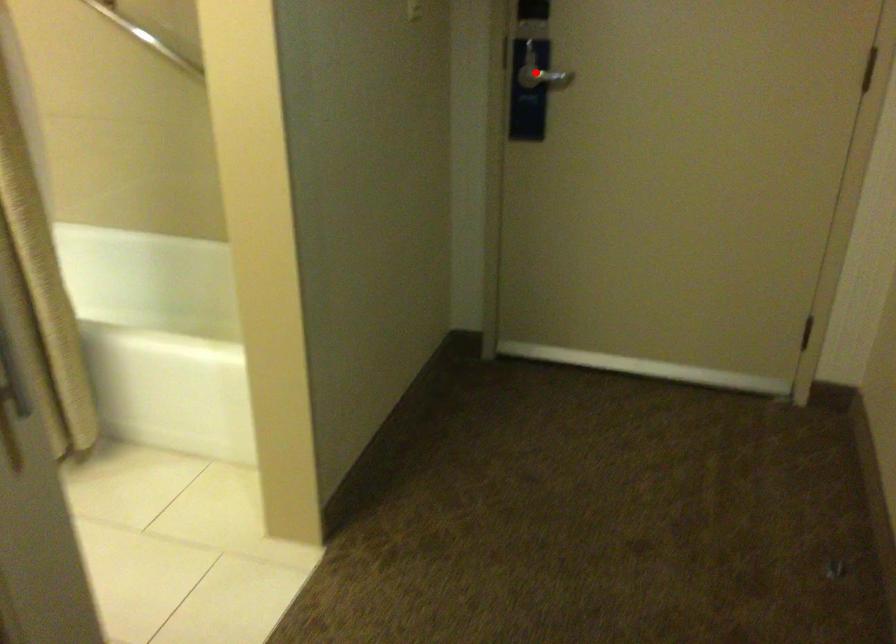
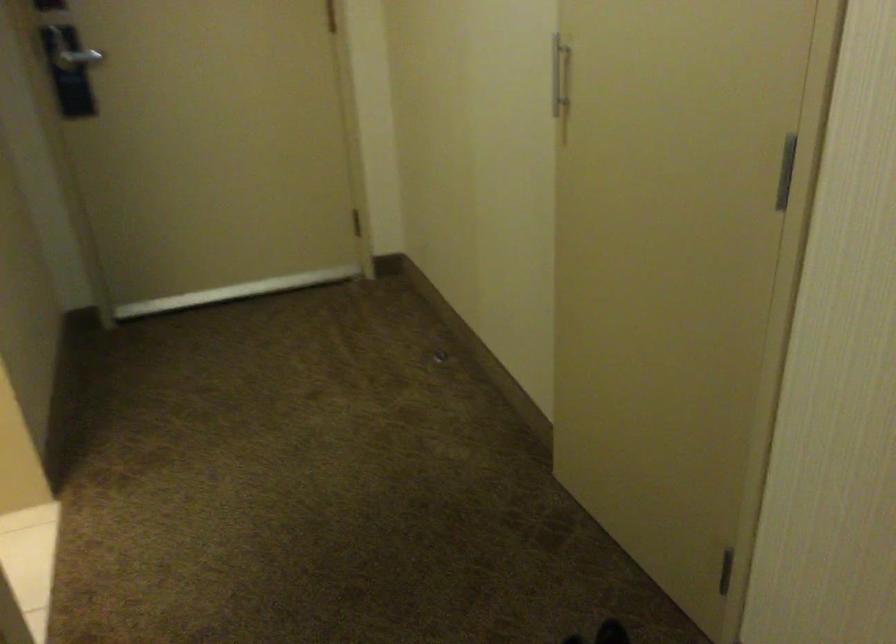
Question: I am providing you with two images of the same scene from different viewpoints. A red point is marked on the first image. Can you still see the location of the red point in image 2?

Choices:
 (A) Yes
 (B) No

Answer: (A)